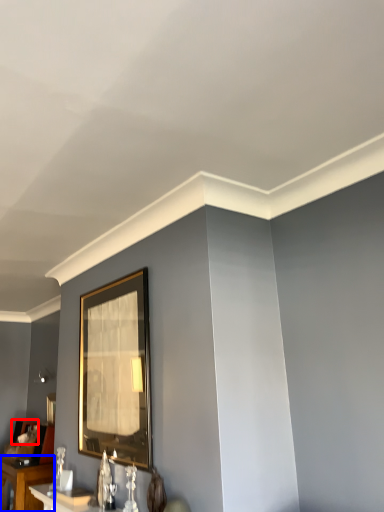
Question: Among these objects, which one is farthest to the camera, picture frame (highlighted by a red box) or table (highlighted by a blue box)?

Choices:
 (A) picture frame
 (B) table

Answer: (A)